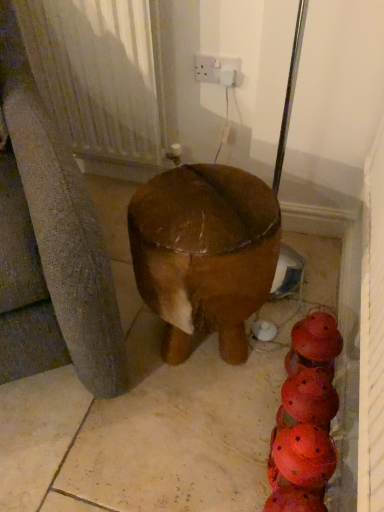
The width and height of the screenshot is (384, 512). What do you see at coordinates (177, 433) in the screenshot?
I see `brown matte concrete at center` at bounding box center [177, 433].

Describe the element at coordinates (204, 254) in the screenshot. I see `brown polished wood stool at center` at that location.

Based on the photo, measure the distance between brown polished wood stool at center and camera.

The distance of brown polished wood stool at center from camera is 31.22 inches.

You are a GUI agent. You are given a task and a screenshot of the screen. Output one action in this format:
    pyautogui.click(x=<x>, y=<y>)
    Task: Click on the brown matte concrete at center
    
    Given the screenshot: What is the action you would take?
    pyautogui.click(x=177, y=433)

Can you confirm if brown matte concrete at center is wider than white plastic socket at upper center?

Yes.

Is brown matte concrete at center inside the boundaries of white plastic socket at upper center, or outside?

brown matte concrete at center lies outside white plastic socket at upper center.

Which is more to the right, brown matte concrete at center or white plastic socket at upper center?

white plastic socket at upper center is more to the right.

Is brown matte concrete at center facing towards white plastic socket at upper center?

No, brown matte concrete at center is not oriented towards white plastic socket at upper center.

Where is `concrete below the white plastic socket at upper center (from a real-world perspective)`? The width and height of the screenshot is (384, 512). concrete below the white plastic socket at upper center (from a real-world perspective) is located at coordinates (177, 433).

Considering the sizes of white plastic socket at upper center and brown matte concrete at center in the image, is white plastic socket at upper center taller or shorter than brown matte concrete at center?

white plastic socket at upper center is shorter than brown matte concrete at center.

Which is more to the right, white plastic socket at upper center or brown matte concrete at center?

Positioned to the right is white plastic socket at upper center.

Between point (215, 68) and point (79, 475), which one is positioned behind?

The point (215, 68) is farther from the camera.

Does brown polished wood stool at center lie behind white plastic socket at upper center?

No, the depth of brown polished wood stool at center is less than that of white plastic socket at upper center.

From the image's perspective, which one is positioned higher, brown polished wood stool at center or white plastic socket at upper center?

white plastic socket at upper center, from the image's perspective.

From a real-world perspective, is brown polished wood stool at center above or below white plastic socket at upper center?

Clearly, from a real-world perspective, brown polished wood stool at center is below white plastic socket at upper center.

Is brown polished wood stool at center at the right side of white plastic socket at upper center?

In fact, brown polished wood stool at center is to the left of white plastic socket at upper center.

Does brown matte concrete at center have a greater width compared to brown polished wood stool at center?

Yes, brown matte concrete at center is wider than brown polished wood stool at center.

Between brown matte concrete at center and brown polished wood stool at center, which one appears on the right side from the viewer's perspective?

brown polished wood stool at center.

From the image's perspective, which is above, brown matte concrete at center or brown polished wood stool at center?

brown polished wood stool at center.

From a real-world perspective, who is located higher, brown matte concrete at center or brown polished wood stool at center?

brown polished wood stool at center, from a real-world perspective.

Where is `electric outlet above the white textured radiator at upper left (from the image's perspective)`? This screenshot has width=384, height=512. electric outlet above the white textured radiator at upper left (from the image's perspective) is located at coordinates (218, 70).

Could you tell me if white plastic socket at upper center is turned towards white textured radiator at upper left?

No, white plastic socket at upper center does not turn towards white textured radiator at upper left.

Between white plastic socket at upper center and white textured radiator at upper left, which one appears on the right side from the viewer's perspective?

white plastic socket at upper center is more to the right.

From the image's perspective, is white plastic socket at upper center below white textured radiator at upper left?

No, from the image's perspective, white plastic socket at upper center is not beneath white textured radiator at upper left.

Considering their positions, is white textured radiator at upper left located in front of or behind brown matte concrete at center?

Clearly, white textured radiator at upper left is behind brown matte concrete at center.

From a real-world perspective, who is located higher, white textured radiator at upper left or brown matte concrete at center?

From a 3D spatial view, white textured radiator at upper left is above.

Are white textured radiator at upper left and brown matte concrete at center beside each other?

white textured radiator at upper left and brown matte concrete at center are clearly separated.

Is white textured radiator at upper left bigger than brown matte concrete at center?

Actually, white textured radiator at upper left might be smaller than brown matte concrete at center.

Between point (144, 106) and point (207, 239), which one is positioned behind?

The point (144, 106) is behind.

This screenshot has width=384, height=512. There is a brown polished wood stool at center. Identify the location of radiator above it (from a real-world perspective). (99, 73).

Considering the sizes of white textured radiator at upper left and brown polished wood stool at center in the image, is white textured radiator at upper left taller or shorter than brown polished wood stool at center?

Clearly, white textured radiator at upper left is taller compared to brown polished wood stool at center.

How much distance is there between white textured radiator at upper left and brown polished wood stool at center?

white textured radiator at upper left and brown polished wood stool at center are 20.60 inches apart.

Identify the location of electric outlet to the right of brown matte concrete at center. (218, 70).

Locate an element on the screen. concrete below the white plastic socket at upper center (from the image's perspective) is located at coordinates (177, 433).

When comparing their distances from white plastic socket at upper center, does white textured radiator at upper left or brown matte concrete at center seem further?

The object further to white plastic socket at upper center is brown matte concrete at center.

When comparing their distances from white textured radiator at upper left, does white plastic socket at upper center or brown polished wood stool at center seem closer?

white plastic socket at upper center is positioned closer to the anchor white textured radiator at upper left.

Which object lies further to the anchor point white textured radiator at upper left, brown polished wood stool at center or brown matte concrete at center?

brown matte concrete at center is positioned further to the anchor white textured radiator at upper left.

Considering their positions, is white textured radiator at upper left positioned further to brown polished wood stool at center than white plastic socket at upper center?

Based on the image, white plastic socket at upper center appears to be further to brown polished wood stool at center.

When comparing their distances from white textured radiator at upper left, does brown matte concrete at center or white plastic socket at upper center seem closer?

white plastic socket at upper center lies closer to white textured radiator at upper left than the other object.

Based on their spatial positions, is white textured radiator at upper left or brown matte concrete at center closer to brown polished wood stool at center?

Based on the image, brown matte concrete at center appears to be nearer to brown polished wood stool at center.

Which object lies further to the anchor point brown polished wood stool at center, brown matte concrete at center or white textured radiator at upper left?

white textured radiator at upper left is positioned further to the anchor brown polished wood stool at center.

Considering their positions, is white plastic socket at upper center positioned closer to brown polished wood stool at center than brown matte concrete at center?

Based on the image, brown matte concrete at center appears to be nearer to brown polished wood stool at center.

The height and width of the screenshot is (512, 384). What are the coordinates of `furniture between white textured radiator at upper left and brown matte concrete at center from top to bottom` in the screenshot? It's located at (204, 254).

Where is `radiator between white plastic socket at upper center and brown matte concrete at center in the vertical direction`? The height and width of the screenshot is (512, 384). radiator between white plastic socket at upper center and brown matte concrete at center in the vertical direction is located at coordinates (99, 73).

The image size is (384, 512). In order to click on furniture between white plastic socket at upper center and brown matte concrete at center from top to bottom in this screenshot , I will do `click(204, 254)`.

Locate an element on the screen. radiator between white plastic socket at upper center and brown polished wood stool at center in the up-down direction is located at coordinates click(99, 73).